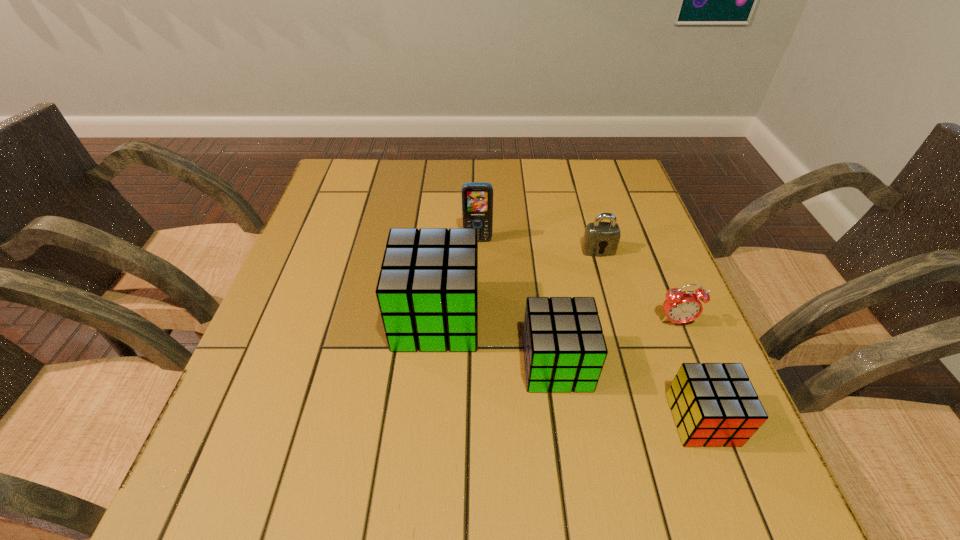
The height and width of the screenshot is (540, 960). I want to click on the leftmost cube, so click(427, 291).

Where is `the fourth object from right to left`? The image size is (960, 540). the fourth object from right to left is located at coordinates pyautogui.click(x=564, y=348).

The height and width of the screenshot is (540, 960). In order to click on the second cube from left to right in this screenshot , I will do `click(564, 348)`.

In order to click on the nearest object in this screenshot , I will do `click(713, 404)`.

Identify the location of the nearest cube. The image size is (960, 540). (713, 404).

Identify the location of the farthest object. (477, 198).

Find the location of a particular element. the third object from right to left is located at coordinates (601, 239).

At what (x,y) coordinates should I click in order to perform the action: click on the fifth nearest object. Please return your answer as a coordinate pair (x, y). The image size is (960, 540). Looking at the image, I should click on (601, 239).

At what (x,y) coordinates should I click in order to perform the action: click on alarm clock. Please return your answer as a coordinate pair (x, y). Looking at the image, I should click on (680, 307).

The height and width of the screenshot is (540, 960). Find the location of `free spot located 0.330m on the right of the tallest cube`. free spot located 0.330m on the right of the tallest cube is located at coordinates (635, 319).